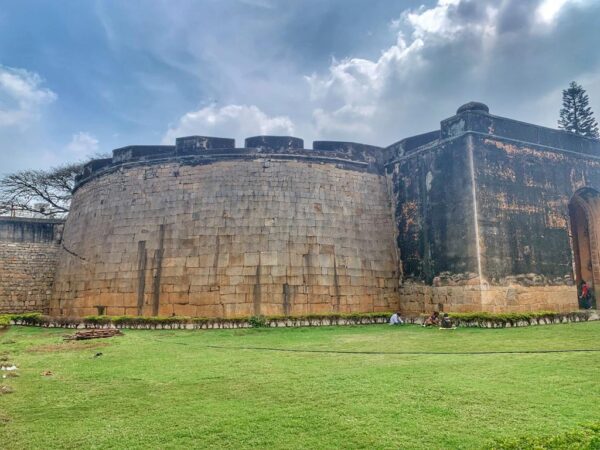
I want to click on curved wall, so click(77, 228).